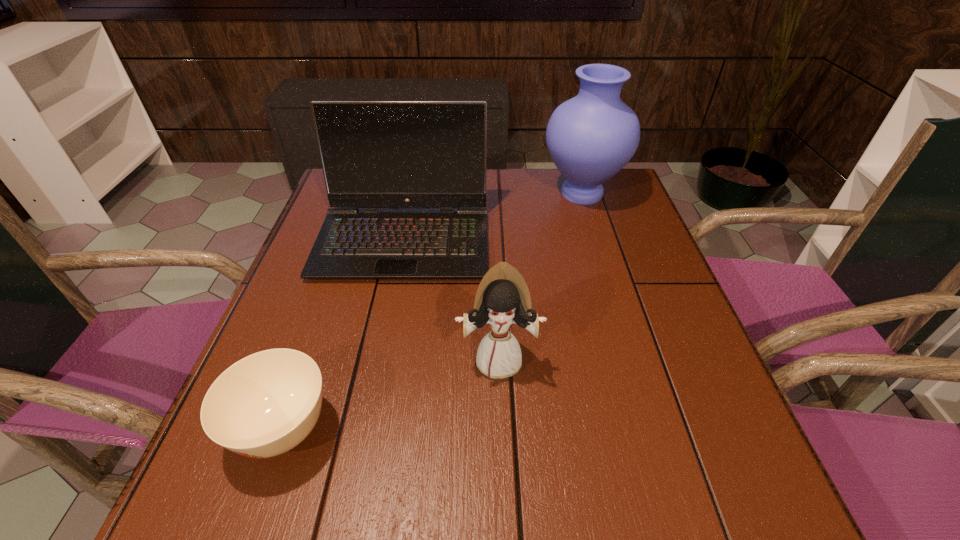
You are a GUI agent. You are given a task and a screenshot of the screen. Output one action in this format:
    pyautogui.click(x=<x>, y=<y>)
    Task: Click on the vacant area that lies between the vase and the doll
    The height and width of the screenshot is (540, 960).
    Given the screenshot: What is the action you would take?
    pyautogui.click(x=540, y=276)

You are a GUI agent. You are given a task and a screenshot of the screen. Output one action in this format:
    pyautogui.click(x=<x>, y=<y>)
    Task: Click on the free area in between the shortest object and the laptop computer
    
    Given the screenshot: What is the action you would take?
    pyautogui.click(x=344, y=334)

The width and height of the screenshot is (960, 540). I want to click on vacant area that lies between the nearest object and the doll, so click(391, 394).

The width and height of the screenshot is (960, 540). What are the coordinates of `free point between the laptop computer and the rightmost object` in the screenshot? It's located at (492, 216).

Locate which object ranks in proximity to the third farthest object. Please provide its 2D coordinates. Your answer should be formatted as a tuple, i.e. [(x, y)], where the tuple contains the x and y coordinates of a point satisfying the conditions above.

[(375, 154)]

Locate which object is the second closest to the laptop computer. Please provide its 2D coordinates. Your answer should be formatted as a tuple, i.e. [(x, y)], where the tuple contains the x and y coordinates of a point satisfying the conditions above.

[(502, 299)]